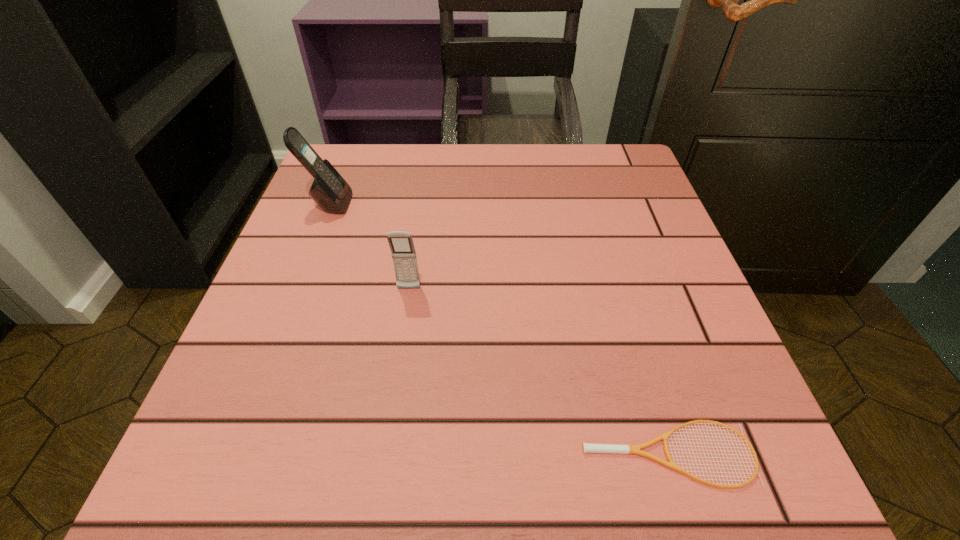
You are a GUI agent. You are given a task and a screenshot of the screen. Output one action in this format:
    pyautogui.click(x=<x>, y=<y>)
    Task: Click on the vacant space at the far right corner of the desktop
    Image resolution: width=960 pixels, height=540 pixels.
    Given the screenshot: What is the action you would take?
    pyautogui.click(x=580, y=167)

You are a GUI agent. You are given a task and a screenshot of the screen. Output one action in this format:
    pyautogui.click(x=<x>, y=<y>)
    Task: Click on the vacant region at the near right corner of the desktop
    This screenshot has height=540, width=960.
    Given the screenshot: What is the action you would take?
    pyautogui.click(x=739, y=472)

Image resolution: width=960 pixels, height=540 pixels. Identify the location of vacant space that is in between the right cellular telephone and the left cellular telephone. (369, 246).

Locate an element on the screen. The image size is (960, 540). free space between the second object from left to right and the farthest object is located at coordinates (369, 246).

I want to click on vacant area that lies between the shorter cellular telephone and the rightmost object, so click(539, 372).

Where is `vacant space that is in between the second object from left to right and the tallest object`? The image size is (960, 540). vacant space that is in between the second object from left to right and the tallest object is located at coordinates (369, 246).

Where is `free space between the rightmost object and the second shortest object`? This screenshot has width=960, height=540. free space between the rightmost object and the second shortest object is located at coordinates (539, 372).

This screenshot has width=960, height=540. Identify the location of empty space between the second tallest object and the shortest object. (539, 372).

This screenshot has width=960, height=540. I want to click on free area in between the rightmost object and the second farthest object, so click(539, 372).

The image size is (960, 540). In order to click on vacant area that lies between the tennis racket and the second object from left to right in this screenshot , I will do `click(539, 372)`.